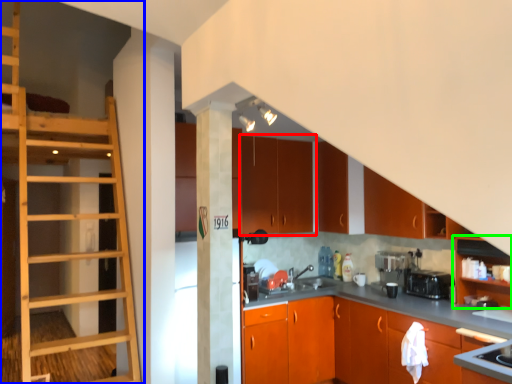
Question: Considering the real-world distances, which object is closest to cabinetry (highlighted by a red box)? ladder (highlighted by a blue box) or cabinetry (highlighted by a green box).

Choices:
 (A) ladder
 (B) cabinetry

Answer: (A)